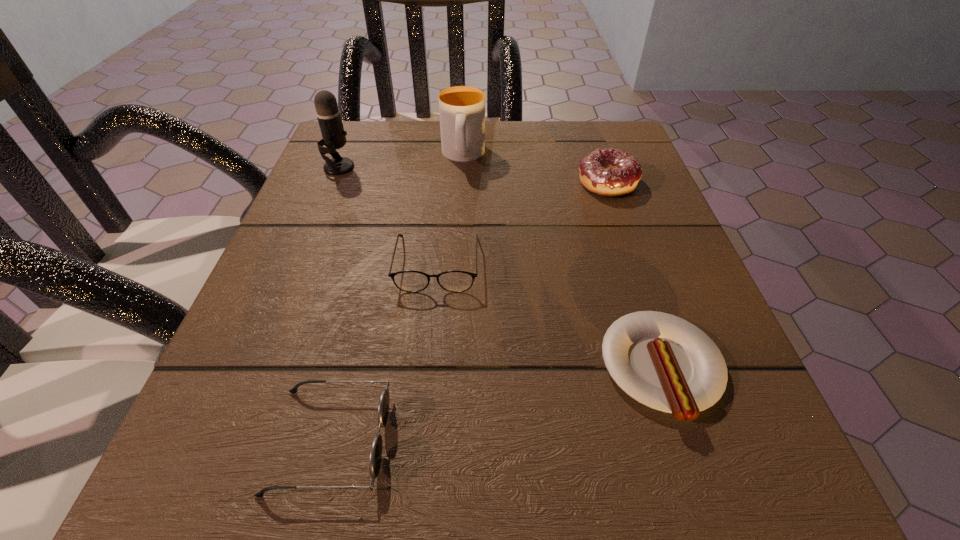
At what (x,y) coordinates should I click in order to perform the action: click on vacant space that is in between the spectacles and the sunglasses. Please return your answer as a coordinate pair (x, y). This screenshot has width=960, height=540. Looking at the image, I should click on 384,352.

This screenshot has width=960, height=540. In order to click on free spot between the fourth farthest object and the sausage in this screenshot , I will do `click(549, 316)`.

Image resolution: width=960 pixels, height=540 pixels. What are the coordinates of `empty location between the second tallest object and the spectacles` in the screenshot? It's located at [x=450, y=210].

Image resolution: width=960 pixels, height=540 pixels. Find the location of `blank region between the cup and the microphone`. blank region between the cup and the microphone is located at coordinates (401, 161).

What are the coordinates of `free space between the doughnut and the spectacles` in the screenshot? It's located at (522, 224).

Identify the location of free spot between the sunglasses and the doughnut. (468, 312).

What are the coordinates of `vacant space that is in between the microphone and the cup` in the screenshot? It's located at (401, 161).

Image resolution: width=960 pixels, height=540 pixels. What are the coordinates of `free spot between the sausage and the cup` in the screenshot? It's located at (563, 262).

This screenshot has height=540, width=960. In order to click on vacant space that is in between the sausage and the tallest object in this screenshot , I will do `click(500, 268)`.

The width and height of the screenshot is (960, 540). Identify the location of free space between the fourth farthest object and the doughnut. (522, 224).